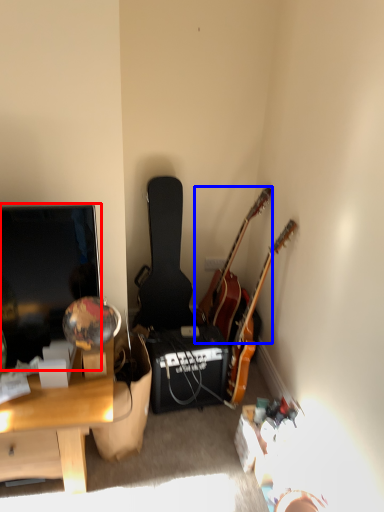
Question: Which point is closer to the camera, television (highlighted by a red box) or guitar (highlighted by a blue box)?

Choices:
 (A) television
 (B) guitar

Answer: (A)